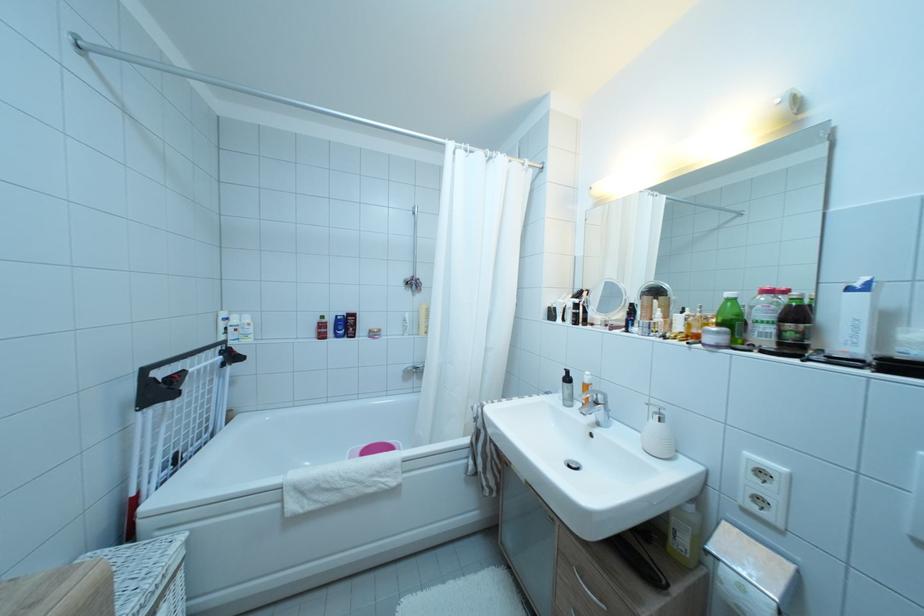
Locate an element on the screen. The width and height of the screenshot is (924, 616). silver cabinet handle is located at coordinates (598, 592).